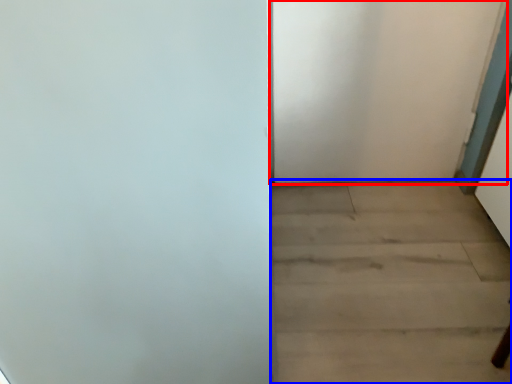
Question: Which object is further to the camera taking this photo, door (highlighted by a red box) or stairwell (highlighted by a blue box)?

Choices:
 (A) door
 (B) stairwell

Answer: (A)